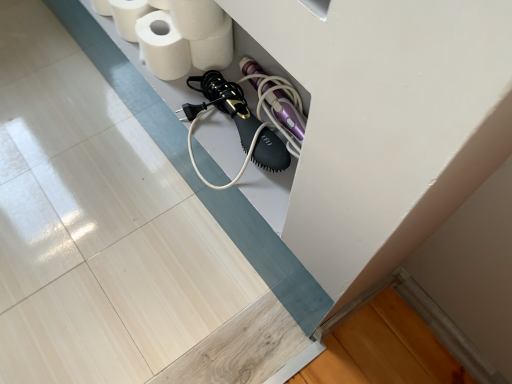
Question: In the image, is white matte toilet paper at upper center, arranged as the 1th toilet paper when viewed from the right, positioned in front of or behind white matte toilet paper at upper left, which ranks as the second toilet paper in left-to-right order?

Choices:
 (A) front
 (B) behind

Answer: (B)

Question: Looking at the image, does white matte toilet paper at upper center, which is the fourth toilet paper from left to right, seem bigger or smaller compared to white matte toilet paper at upper left, the 3th toilet paper positioned from the right?

Choices:
 (A) small
 (B) big

Answer: (A)

Question: Considering the real-world distances, which object is farthest from the white matte toilet paper at upper center, placed as the second toilet paper when sorted from right to left?

Choices:
 (A) white matte toilet paper at upper left, which appears as the 4th toilet paper when viewed from the right
 (B) white matte toilet paper at upper center, arranged as the 1th toilet paper when viewed from the right
 (C) white matte toilet paper at upper left, the 3th toilet paper positioned from the right

Answer: (A)

Question: Based on their relative distances, which object is farther from the white matte toilet paper at upper left, which appears as the 4th toilet paper when viewed from the right?

Choices:
 (A) white matte toilet paper at upper left, which ranks as the second toilet paper in left-to-right order
 (B) white matte toilet paper at upper center, which ranks as the 3th toilet paper in left-to-right order
 (C) white matte toilet paper at upper center, which is the fourth toilet paper from left to right

Answer: (C)